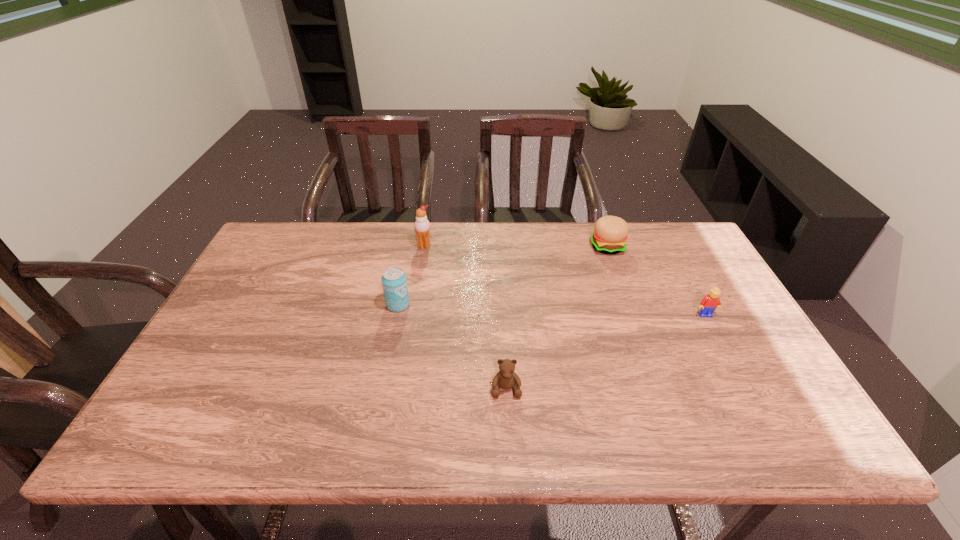
Where is `icecream`? The height and width of the screenshot is (540, 960). icecream is located at coordinates (422, 226).

Identify the location of beer can. coord(394,281).

Image resolution: width=960 pixels, height=540 pixels. I want to click on the second object from right to left, so click(610, 233).

Locate an element on the screen. The image size is (960, 540). Lego is located at coordinates (708, 304).

At what (x,y) coordinates should I click in order to perform the action: click on the nearest object. Please return your answer as a coordinate pair (x, y). Looking at the image, I should click on click(x=506, y=378).

I want to click on teddy bear, so click(x=506, y=378).

Identify the location of free space located at the front with a straw on the tallest object. This screenshot has height=540, width=960. (411, 332).

This screenshot has height=540, width=960. Find the location of `vacant space located on the back of the beer can`. vacant space located on the back of the beer can is located at coordinates (413, 232).

Locate an element on the screen. vacant area situated 0.380m on the left of the hamburger is located at coordinates (474, 246).

I want to click on vacant area located on the front-facing side of the rightmost object, so point(722,347).